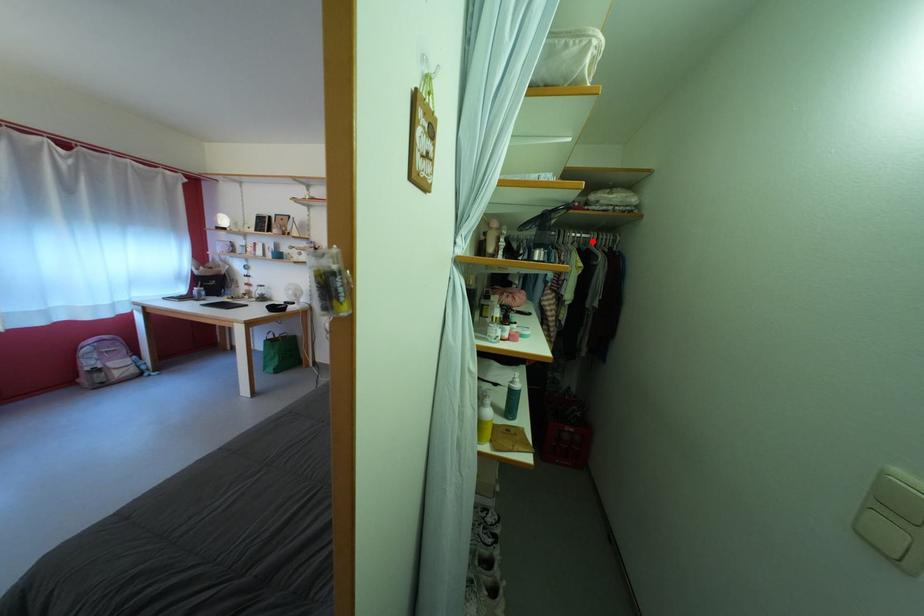
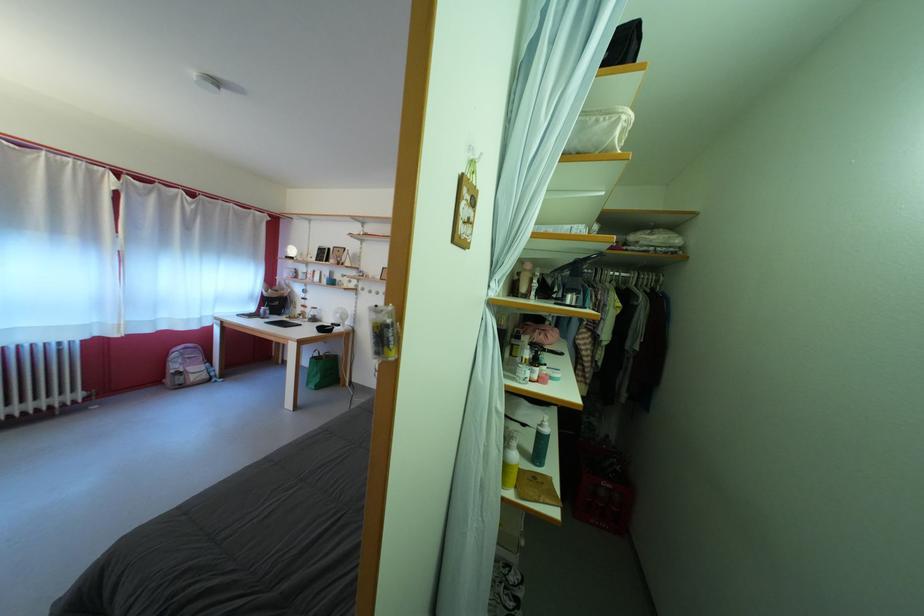
Where in the second image is the point corresponding to the highlighted location from the first image?

(631, 281)